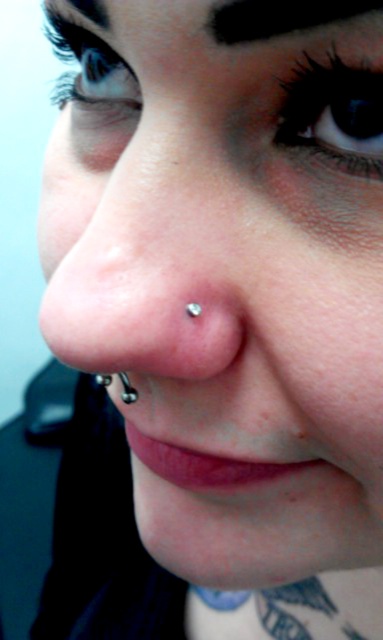
You are an artist trying to sketch this face. You need to decide which of the two points, point (348, 163) or point (104, 76), should be drawn first based on their depth. Which point should you start with?

Point (348, 163) is closer to the viewer than point (104, 76), so you should draw point (348, 163) first to establish the foreground elements before moving to the background.

Looking at the person in the portrait, which of the two eyes, the blue iridescent eye at upper center or the matte blue eye at upper left, is shorter in height?

The blue iridescent eye at upper center is shorter in height than the matte blue eye at upper left.